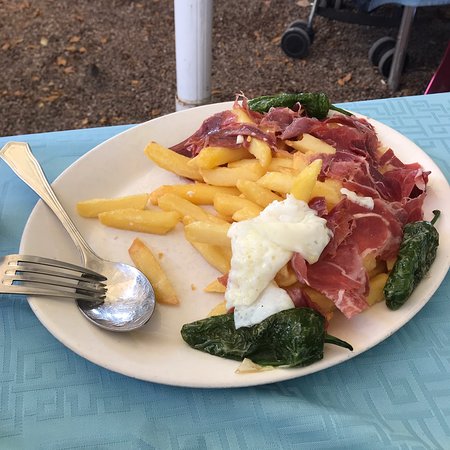
Identify the location of spoon handle. Image resolution: width=450 pixels, height=450 pixels. (25, 159).